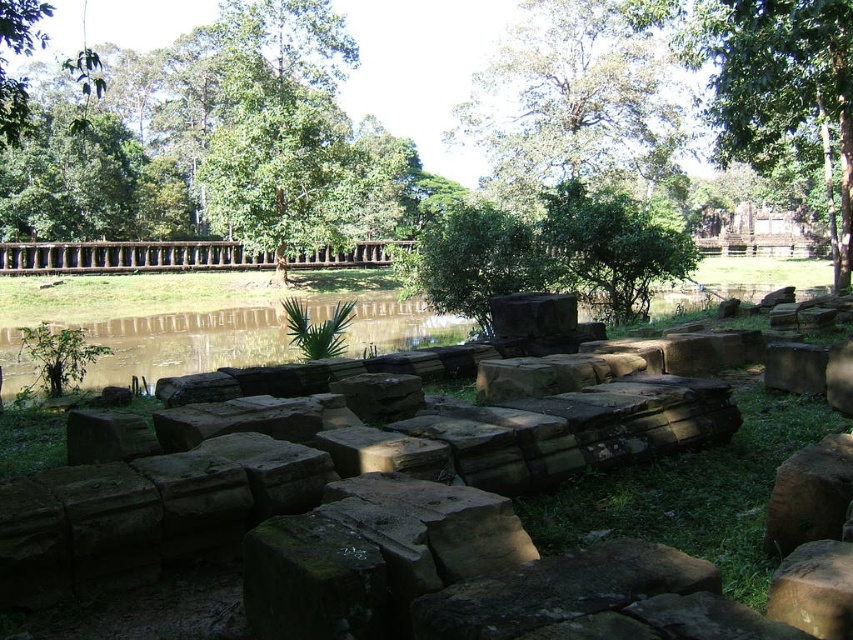
Can you confirm if green leafy tree at upper center is shorter than green leafy tree at upper right?

No, green leafy tree at upper center is not shorter than green leafy tree at upper right.

Measure the distance from green leafy tree at upper center to green leafy tree at upper right.

green leafy tree at upper center and green leafy tree at upper right are 17.00 meters apart.

Which is behind, point (498, 198) or point (749, 49)?

Point (498, 198)

This screenshot has width=853, height=640. I want to click on green leafy tree at upper center, so click(x=573, y=106).

Which is above, green leafy tree at upper center or brown/earthy water at center?

green leafy tree at upper center is above.

Is point (514, 20) more distant than point (387, 342)?

Yes, it is behind point (387, 342).

Locate an element on the screen. The width and height of the screenshot is (853, 640). green leafy tree at upper center is located at coordinates (573, 106).

Can you confirm if green leafy tree at upper right is thinner than brown/earthy water at center?

Yes, green leafy tree at upper right is thinner than brown/earthy water at center.

Does green leafy tree at upper right have a greater width compared to brown/earthy water at center?

In fact, green leafy tree at upper right might be narrower than brown/earthy water at center.

Between point (752, 76) and point (18, 365), which one is positioned behind?

Point (18, 365)

The image size is (853, 640). I want to click on green leafy tree at upper right, so click(776, 83).